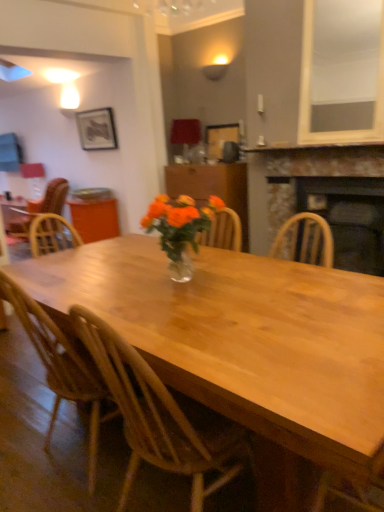
Question: Considering the positions of point (183, 276) and point (347, 260), is point (183, 276) closer or farther from the camera than point (347, 260)?

Choices:
 (A) closer
 (B) farther

Answer: (A)

Question: Is translucent glass vase at center wider or thinner than rustic stone fireplace at right, marked as the second fireplace in a bottom-to-top arrangement?

Choices:
 (A) wide
 (B) thin

Answer: (B)

Question: Considering the real-world distances, which object is farthest from the rustic stone fireplace at right, marked as the second fireplace in a bottom-to-top arrangement?

Choices:
 (A) translucent glass vase at center
 (B) wooden chair at center, the 1th chair in the front-to-back sequence
 (C) stone fireplace at upper center
 (D) wooden picture frame at upper center, which appears as the 2th picture frame when viewed from the top
 (E) wooden cabinet at center

Answer: (B)

Question: Which object is positioned closest to the matte black picture frame at upper left, positioned as the 1th picture frame in top-to-bottom order?

Choices:
 (A) wooden chair at left, which is the 3th chair from front to back
 (B) stone fireplace at upper center
 (C) wooden picture frame at upper center, marked as the first picture frame in a right-to-left arrangement
 (D) wooden chair at center, the 3th chair in the left-to-right sequence
 (E) rustic stone fireplace at right, marked as the second fireplace in a bottom-to-top arrangement

Answer: (A)